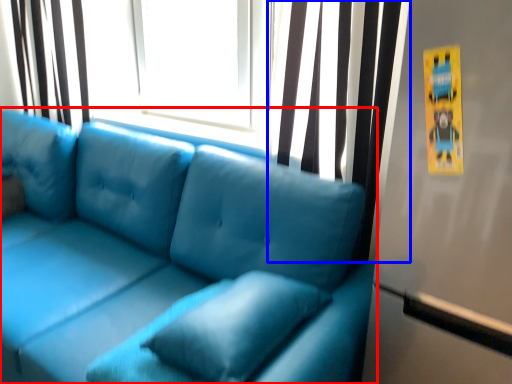
Question: Which object appears farthest to the camera in this image, studio couch (highlighted by a red box) or curtain (highlighted by a blue box)?

Choices:
 (A) studio couch
 (B) curtain

Answer: (B)